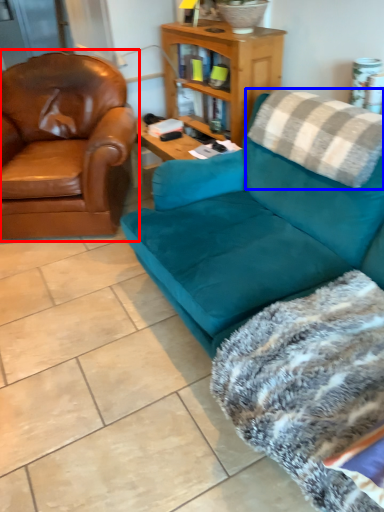
Question: Among these objects, which one is farthest to the camera, chair (highlighted by a red box) or pillow (highlighted by a blue box)?

Choices:
 (A) chair
 (B) pillow

Answer: (A)